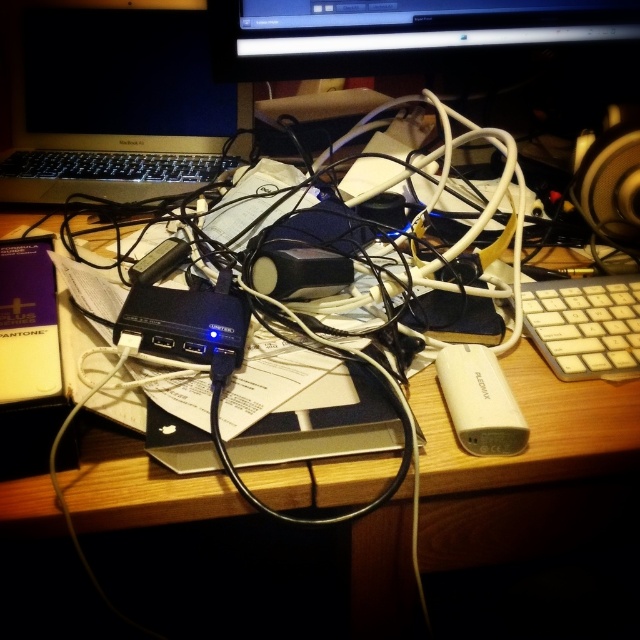
You are organizing the desk and want to place a new item between the silver metallic laptop at upper left and the black glossy monitor at upper center. Is there enough space between them for the item?

The silver metallic laptop at upper left is positioned under the black glossy monitor at upper center, meaning they are stacked vertically rather than side by side. Therefore, there is no horizontal space between them to place an item.

You are a person with a 12 inch long ruler. You want to measure the distance from your current position to the silver metallic laptop at upper left. Can you reach it with your ruler?

The silver metallic laptop at upper left is 28.84 inches away from the viewer. Since the ruler is only 12 inches long, it is not long enough to measure the distance. You need a longer ruler or measuring tool.

You are standing at the edge of the desk looking at the clutter. There are two points marked on the desk surface labeled as point (468, 445) and point (632, 136). Which of these points is physically closer to you?

Point (468, 445) is closer to the viewer than point (632, 136).